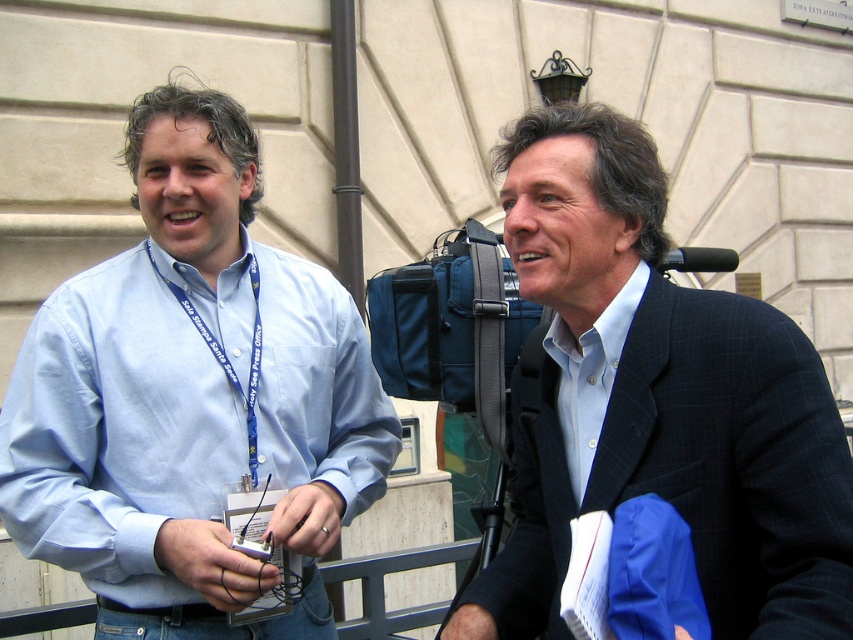
You are a photographer trying to capture a clear photo of the light blue shirt at center and the blue fabric lanyard at left. Which object should you focus on first if you want to ensure both are in focus, considering their sizes?

The light blue shirt at center has a greater height compared to the blue fabric lanyard at left, so you should focus on the light blue shirt at center first as it is larger and requires more precise focus to ensure clarity.

In the scene shown: You are a photographer trying to capture a clear photo of both the light blue shirt at center and the matte black suit at right. Which object should you focus on first to ensure both are in focus?

The light blue shirt at center is bigger than the matte black suit at right, so you should focus on the light blue shirt at center first to ensure both are in focus.

You are a photographer trying to capture a portrait of the person wearing the light blue shirt at center and the blue fabric lanyard at left. Since you want to ensure both subjects are in focus, you need to know their distance apart. Can you determine if they are close enough for a single focus point?

The light blue shirt at center is to the right of the blue fabric lanyard at left, but the exact distance between them isn not specified. Therefore, it is uncertain whether they are within the same focus range for a single focus point.